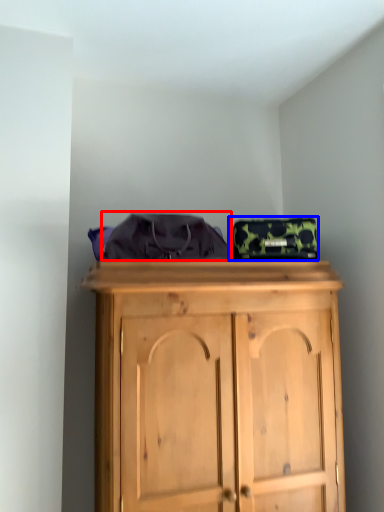
Question: Which point is closer to the camera, clothing (highlighted by a red box) or bag (highlighted by a blue box)?

Choices:
 (A) clothing
 (B) bag

Answer: (A)